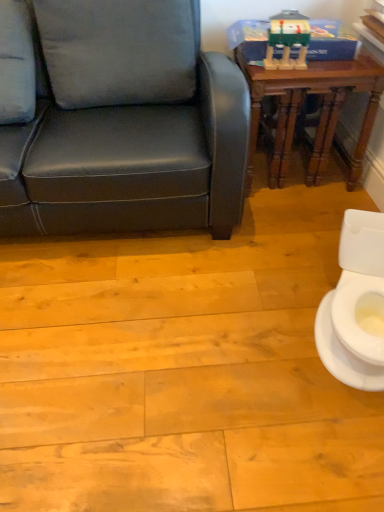
Where is `free space on the front side of white glossy toilet at lower right`? This screenshot has width=384, height=512. free space on the front side of white glossy toilet at lower right is located at coordinates (316, 437).